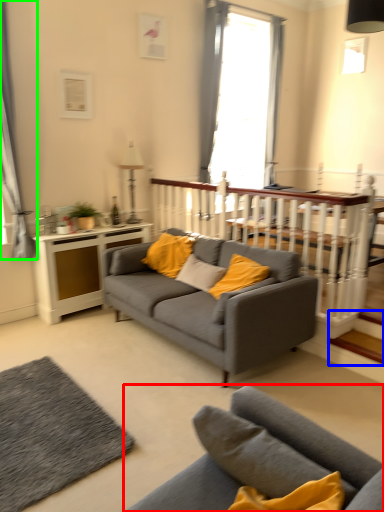
Question: Which object is positioned closest to studio couch (highlighted by a red box)? Select from stairwell (highlighted by a blue box) and curtain (highlighted by a green box).

Choices:
 (A) stairwell
 (B) curtain

Answer: (A)